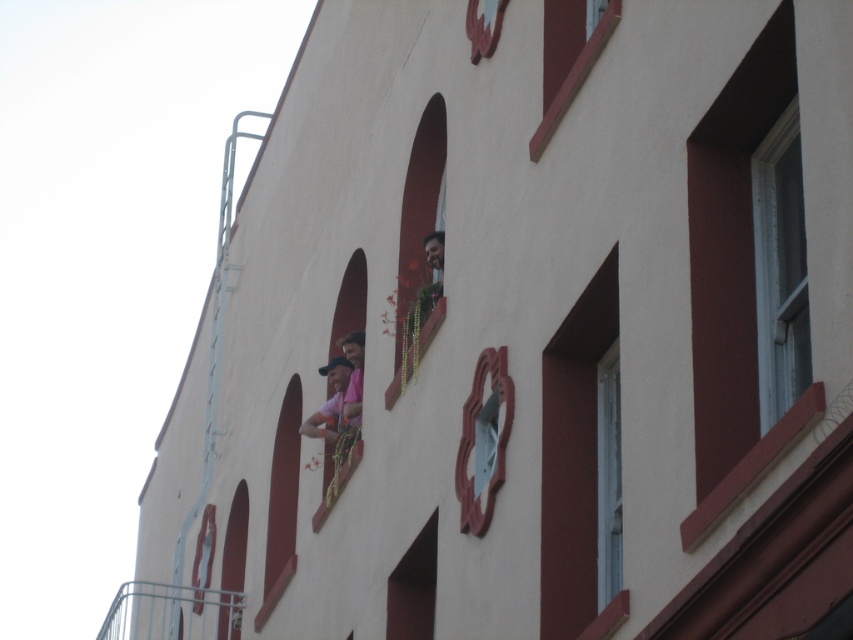
Question: Can you confirm if clear glass window at upper right is positioned above smooth red window at center?

Choices:
 (A) yes
 (B) no

Answer: (A)

Question: Does metallic glass window at right have a lesser width compared to pink fabric at center?

Choices:
 (A) no
 (B) yes

Answer: (B)

Question: Estimate the real-world distances between objects in this image. Which object is farther from the metallic glass window at right?

Choices:
 (A) metallic silver railing at lower left
 (B) smooth red window at center

Answer: (A)

Question: Can you confirm if smooth red window at center is wider than smooth red wood window at upper right?

Choices:
 (A) no
 (B) yes

Answer: (A)

Question: Which point is closer to the camera?

Choices:
 (A) (283, 515)
 (B) (608, 12)
 (C) (341, 422)

Answer: (B)

Question: Which of these objects is positioned closest to the metallic silver railing at lower left?

Choices:
 (A) metallic glass window at right
 (B) smooth red window at center
 (C) smooth red wood window at upper right

Answer: (B)